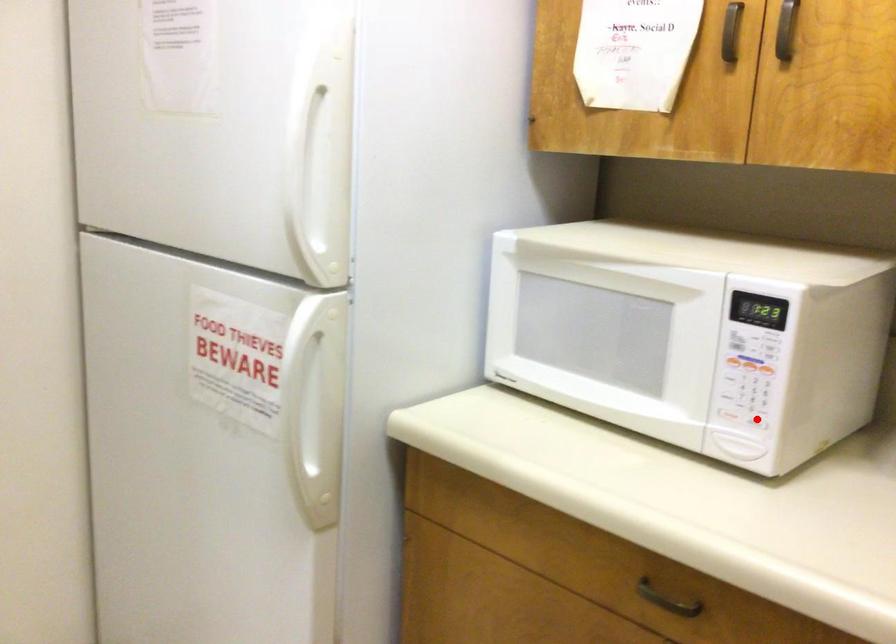
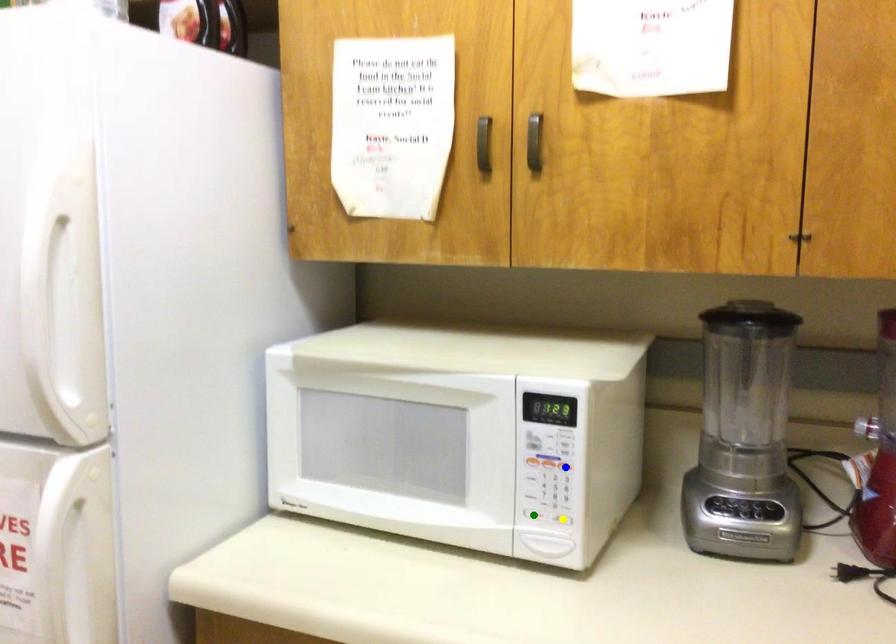
Question: I am providing you with two images of the same scene from different viewpoints. A red point is marked on the first image. You are given multiple points on the second image. Which mark in image 2 goes with the point in image 1?

Choices:
 (A) yellow point
 (B) blue point
 (C) green point

Answer: (A)